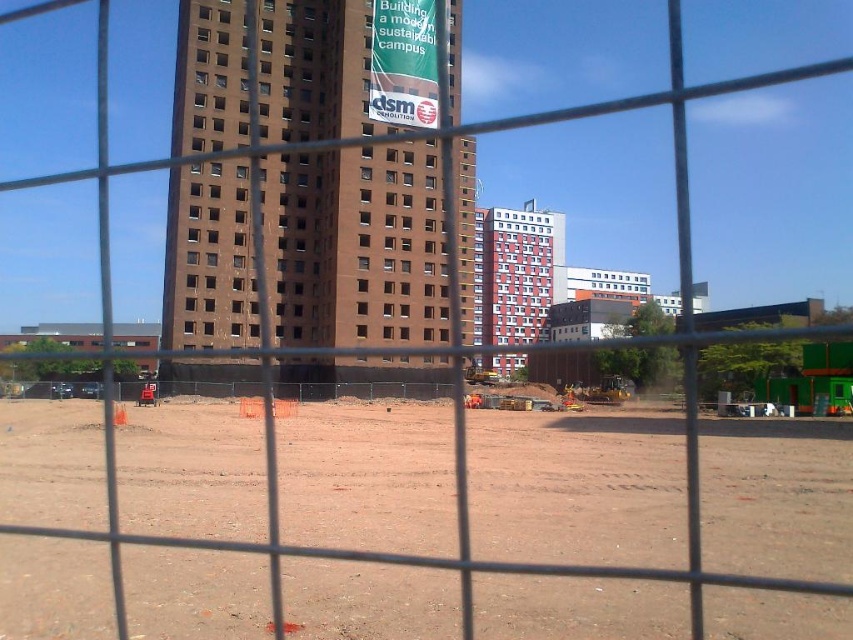
You are a construction worker standing on the brown dirt field at center. You need to place a heavy equipment on the ground. Can you place it on the brown brick building at center?

The brown dirt field at center is positioned under brown brick building at center, so you cannot place the heavy equipment on the brown brick building at center because it is elevated above the dirt field.

You are a construction worker standing at the entrance of the construction site. You need to move a heavy tool from the brown brick building at center to the brown dirt field at center. Which direction should you move the tool to reach the dirt field?

The brown dirt field at center is positioned on the right side of the brown brick building at center, so you should move the tool to the right to reach the dirt field.

What are the coordinates of the brown dirt field at center?

The coordinates of the brown dirt field at center are at point (577, 488).